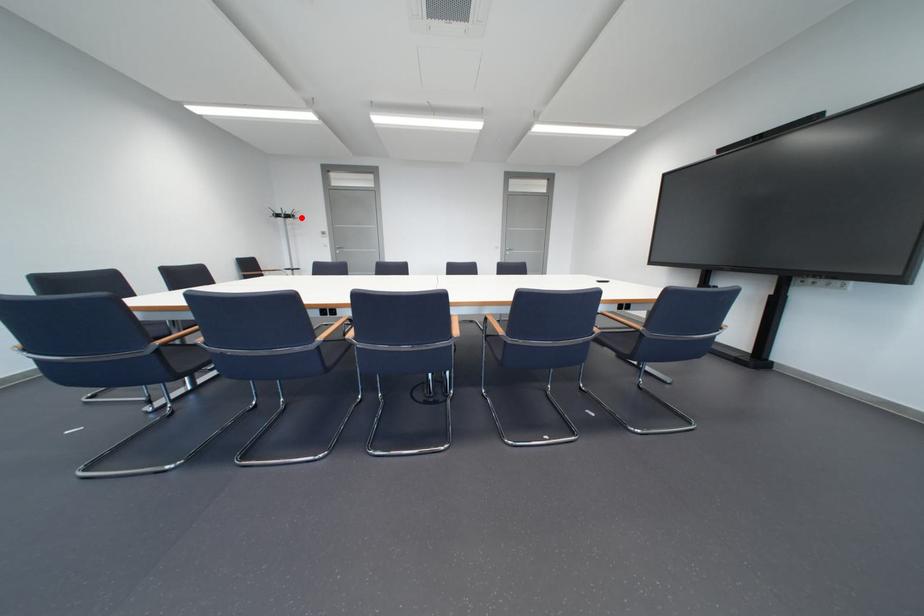
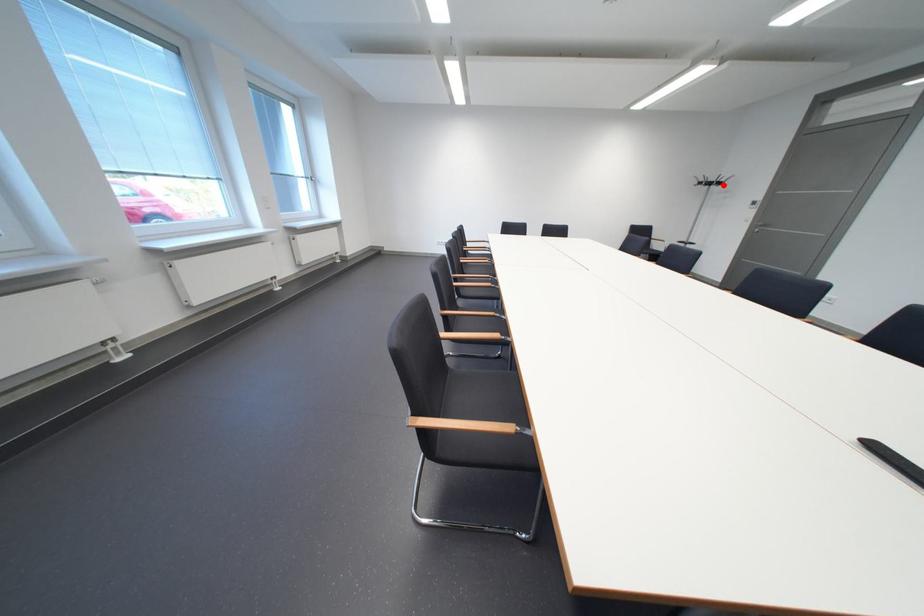
I am providing you with two images of the same scene from different viewpoints. A red point is marked on the first image and another point is marked on the second image. Are the points marked in image1 and image2 representing the same 3D position?

Yes